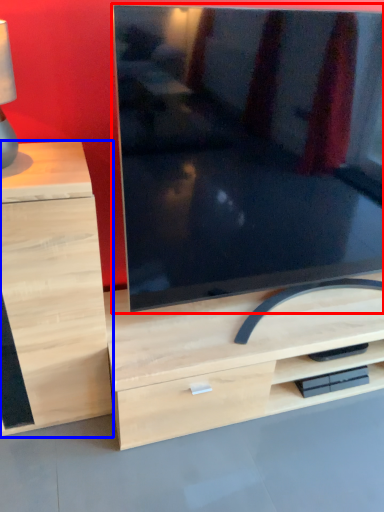
Question: Which object appears closest to the camera in this image, television (highlighted by a red box) or chest of drawers (highlighted by a blue box)?

Choices:
 (A) television
 (B) chest of drawers

Answer: (A)